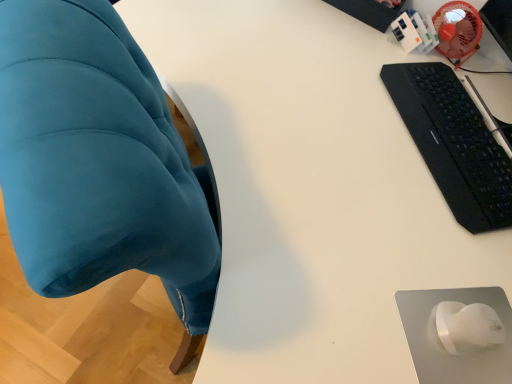
Locate an element on the screen. This screenshot has height=384, width=512. black matte keyboard at right is located at coordinates (454, 143).

In order to face black matte keyboard at right, should I rotate leftwards or rightwards?

Turn right approximately 25.619 degrees to face it.

This screenshot has height=384, width=512. Describe the element at coordinates (454, 143) in the screenshot. I see `black matte keyboard at right` at that location.

Measure the distance between black matte keyboard at right and camera.

black matte keyboard at right and camera are 82.13 centimeters apart from each other.

You are a GUI agent. You are given a task and a screenshot of the screen. Output one action in this format:
    pyautogui.click(x=<x>, y=<y>)
    Task: Click on the black matte keyboard at right
    
    Given the screenshot: What is the action you would take?
    pyautogui.click(x=454, y=143)